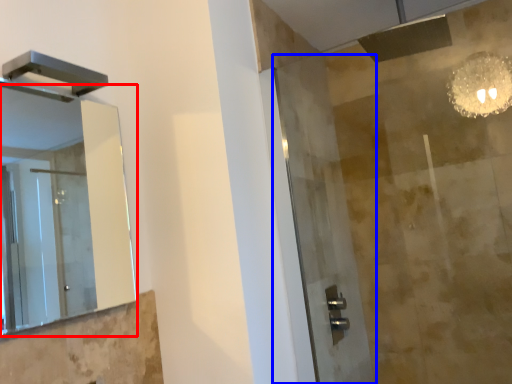
Question: Which object appears farthest to the camera in this image, mirror (highlighted by a red box) or screen door (highlighted by a blue box)?

Choices:
 (A) mirror
 (B) screen door

Answer: (B)